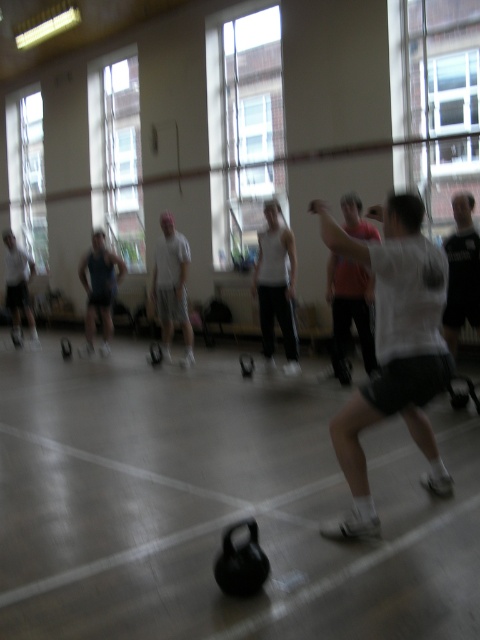
You are a photographer positioned at the back of the gymnasium. You want to take a photo of the white matte shirt at center and the gray fabric shorts at left. Can you see both subjects clearly in your frame without any obstruction?

The white matte shirt at center is in front of the gray fabric shorts at left, so the photographer might not be able to see the gray fabric shorts at left clearly as it is partially or fully obscured by the white matte shirt at center.

You are standing in the gymnasium and want to reach the point marked at coordinates (156, 296). If you walk directly towards it from your current position, how far will you have to walk?

The point at (156, 296) is 8.83 meters away from the viewer, so you would have to walk 8.83 meters to reach it.

You are a photographer taking a picture of the fitness class. You notice the white matte shirt at center and the gray fabric shorts at left. Which clothing item is positioned higher in the image?

The white matte shirt at center is positioned higher than the gray fabric shorts at left.